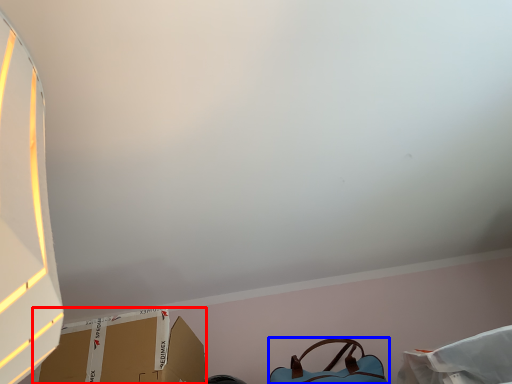
Question: Which object appears farthest to the camera in this image, cardboard box (highlighted by a red box) or handbag (highlighted by a blue box)?

Choices:
 (A) cardboard box
 (B) handbag

Answer: (B)